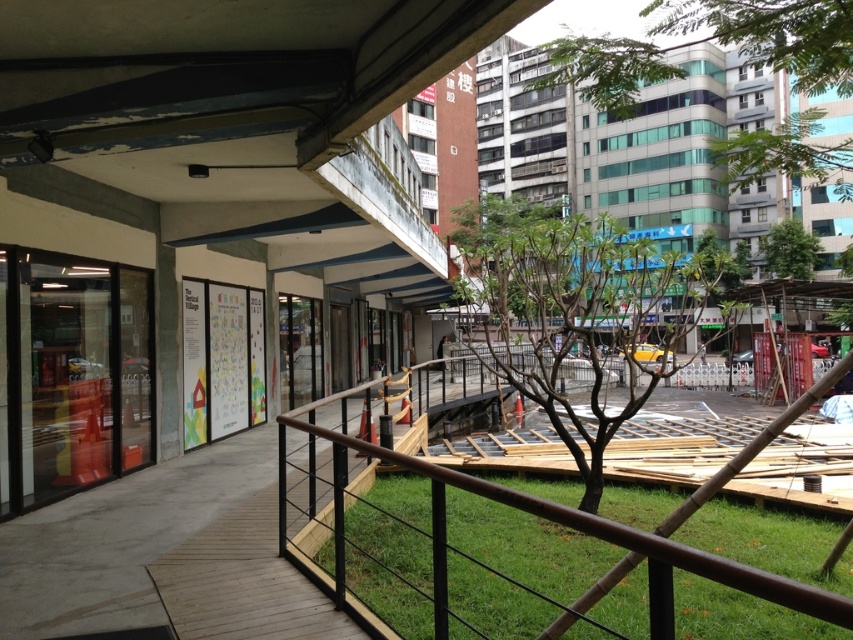
Who is positioned more to the right, green leafy tree at upper center or green leafy tree at upper right?

Positioned to the right is green leafy tree at upper right.

Does green leafy tree at upper center appear on the left side of green leafy tree at upper right?

Indeed, green leafy tree at upper center is positioned on the left side of green leafy tree at upper right.

Who is more forward, (700, 19) or (807, 244)?

Point (700, 19) is more forward.

Find the location of `green leafy tree at upper center`. green leafy tree at upper center is located at coordinates [773, 35].

Which is in front, point (560, 529) or point (807, 131)?

Point (560, 529) is more forward.

Is green grass at lower center to the right of green leafy tree at upper center from the viewer's perspective?

Incorrect, green grass at lower center is not on the right side of green leafy tree at upper center.

Does point (363, 524) come closer to viewer compared to point (808, 84)?

No, (363, 524) is further to viewer.

I want to click on green grass at lower center, so click(x=526, y=545).

I want to click on green leafy tree at center, so click(573, 308).

Does green leafy tree at center have a larger size compared to green leafy tree at upper right?

Indeed, green leafy tree at center has a larger size compared to green leafy tree at upper right.

What do you see at coordinates (573, 308) in the screenshot?
I see `green leafy tree at center` at bounding box center [573, 308].

This screenshot has height=640, width=853. I want to click on green leafy tree at center, so click(573, 308).